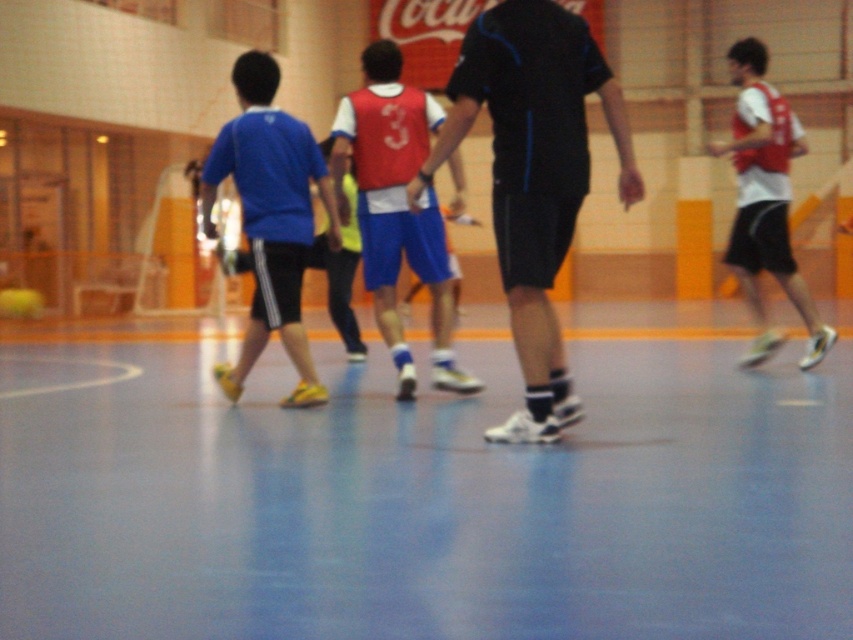
Between black matte shorts at center and matte red jersey at center, which one has more height?

With more height is matte red jersey at center.

Is point (576, 83) behind point (337, 148)?

No, it is not.

Which is in front, point (567, 180) or point (461, 195)?

Point (567, 180) is in front.

This screenshot has height=640, width=853. Find the location of `black matte shorts at center`. black matte shorts at center is located at coordinates (532, 177).

Which is in front, point (431, 216) or point (775, 164)?

Positioned in front is point (431, 216).

Does matte red jersey at center have a greater width compared to white matte jersey at right?

Yes.

The width and height of the screenshot is (853, 640). Find the location of `matte red jersey at center`. matte red jersey at center is located at coordinates (396, 208).

Locate an element on the screen. The image size is (853, 640). matte red jersey at center is located at coordinates (396, 208).

Does matte blue shorts at left lie in front of white matte jersey at right?

Yes, it is.

Does point (218, 173) come behind point (780, 282)?

That is False.

Locate an element on the screen. This screenshot has height=640, width=853. matte blue shorts at left is located at coordinates [x=270, y=218].

You are a GUI agent. You are given a task and a screenshot of the screen. Output one action in this format:
    pyautogui.click(x=<x>, y=<y>)
    Task: Click on the matte blue shorts at left
    This screenshot has height=640, width=853.
    Given the screenshot: What is the action you would take?
    pyautogui.click(x=270, y=218)